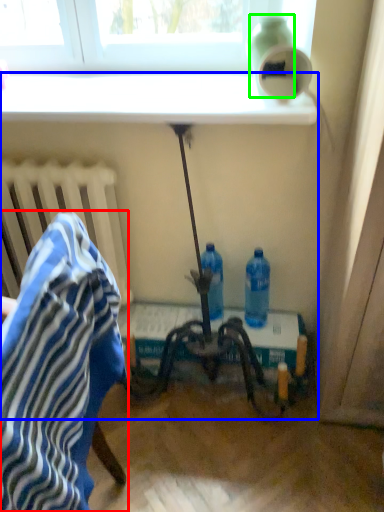
Question: Considering the real-world distances, which object is farthest from chair (highlighted by a red box)? table (highlighted by a blue box) or bottle (highlighted by a green box)?

Choices:
 (A) table
 (B) bottle

Answer: (B)